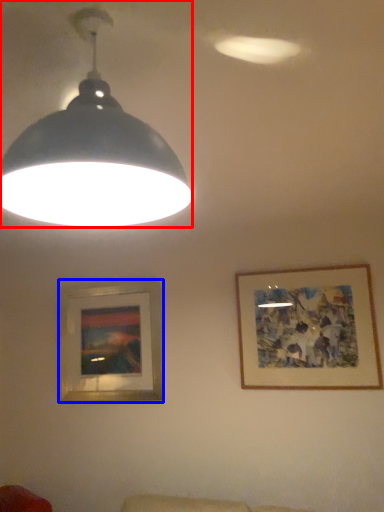
Question: Which point is further to the camera, lamp (highlighted by a red box) or picture frame (highlighted by a blue box)?

Choices:
 (A) lamp
 (B) picture frame

Answer: (B)